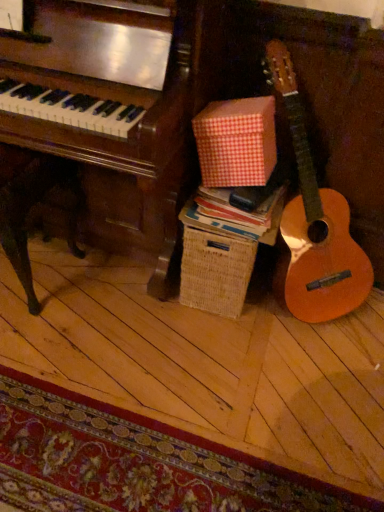
Question: From the image's perspective, is carpeted mat at lower left on red checkered cardboard box at center?

Choices:
 (A) no
 (B) yes

Answer: (A)

Question: Considering the relative sizes of carpeted mat at lower left and red checkered cardboard box at center in the image provided, is carpeted mat at lower left bigger than red checkered cardboard box at center?

Choices:
 (A) no
 (B) yes

Answer: (B)

Question: Considering the relative positions of carpeted mat at lower left and red checkered cardboard box at center in the image provided, is carpeted mat at lower left to the right of red checkered cardboard box at center from the viewer's perspective?

Choices:
 (A) yes
 (B) no

Answer: (B)

Question: Can you confirm if carpeted mat at lower left is wider than red checkered cardboard box at center?

Choices:
 (A) no
 (B) yes

Answer: (B)

Question: Is carpeted mat at lower left positioned far away from red checkered cardboard box at center?

Choices:
 (A) no
 (B) yes

Answer: (A)

Question: Is carpeted mat at lower left aimed at red checkered cardboard box at center?

Choices:
 (A) yes
 (B) no

Answer: (B)

Question: Is carpeted mat at lower left facing towards red checkered paper at center?

Choices:
 (A) yes
 (B) no

Answer: (B)

Question: From a real-world perspective, is carpeted mat at lower left positioned under red checkered paper at center based on gravity?

Choices:
 (A) no
 (B) yes

Answer: (B)

Question: Considering the relative sizes of carpeted mat at lower left and red checkered paper at center in the image provided, is carpeted mat at lower left smaller than red checkered paper at center?

Choices:
 (A) yes
 (B) no

Answer: (B)

Question: From the image's perspective, is carpeted mat at lower left below red checkered paper at center?

Choices:
 (A) yes
 (B) no

Answer: (A)

Question: Is red checkered paper at center at the back of carpeted mat at lower left?

Choices:
 (A) yes
 (B) no

Answer: (B)

Question: Are carpeted mat at lower left and red checkered paper at center beside each other?

Choices:
 (A) yes
 (B) no

Answer: (B)

Question: Is red checkered paper at center next to red checkered cardboard box at center and touching it?

Choices:
 (A) no
 (B) yes

Answer: (A)